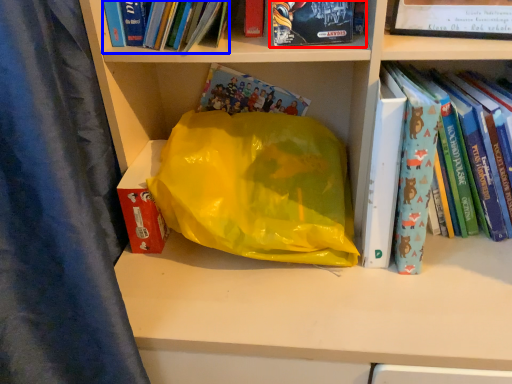
Question: Which of the following is the closest to the observer, book (highlighted by a red box) or book (highlighted by a blue box)?

Choices:
 (A) book
 (B) book

Answer: (B)